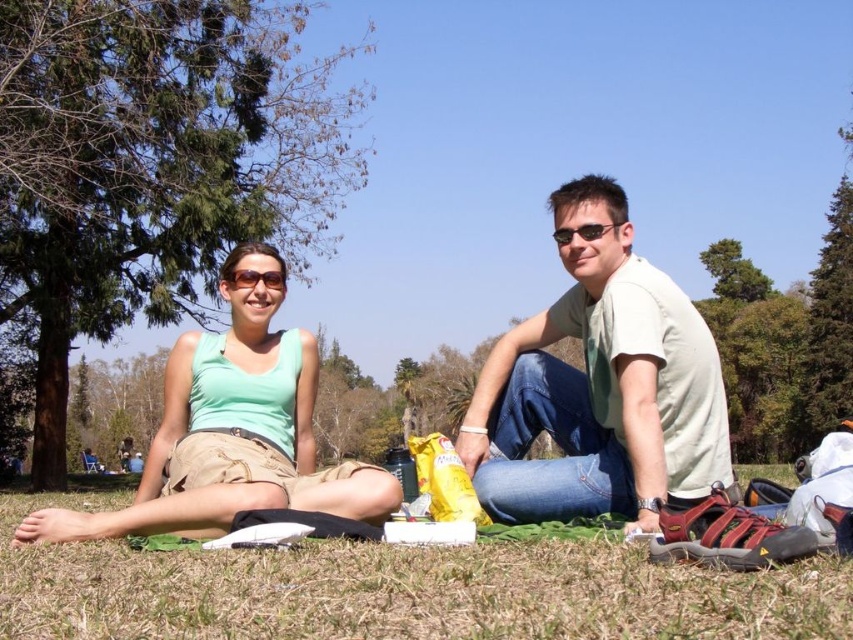
What is located at the coordinate point (395, 589) in the image?

The coordinate point (395, 589) is occupied by green grass at lower center.

You are standing in the park and see both the green fabric at center and the green grass at lower center. Which object is positioned to the right side of the other?

The green fabric at center is to the right of the green grass at lower center.